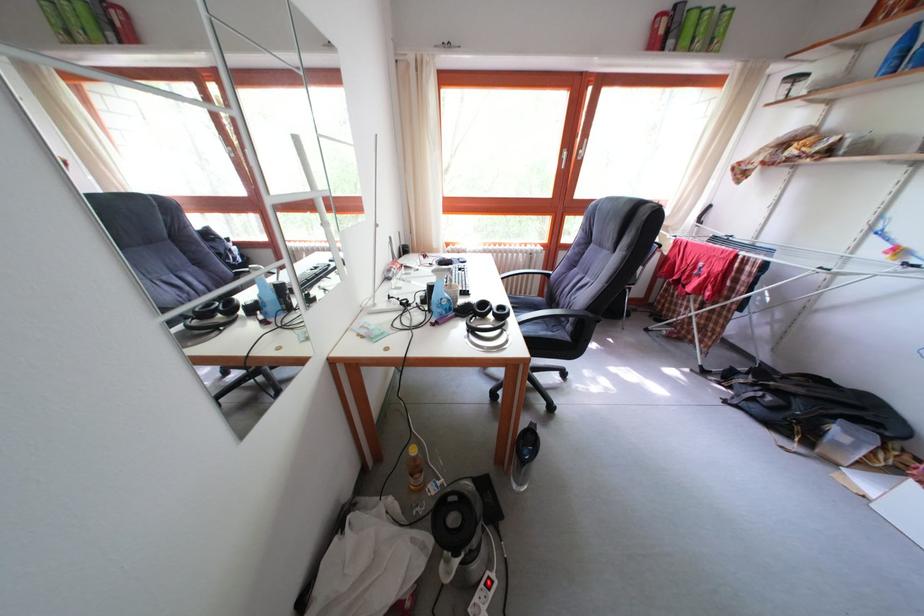
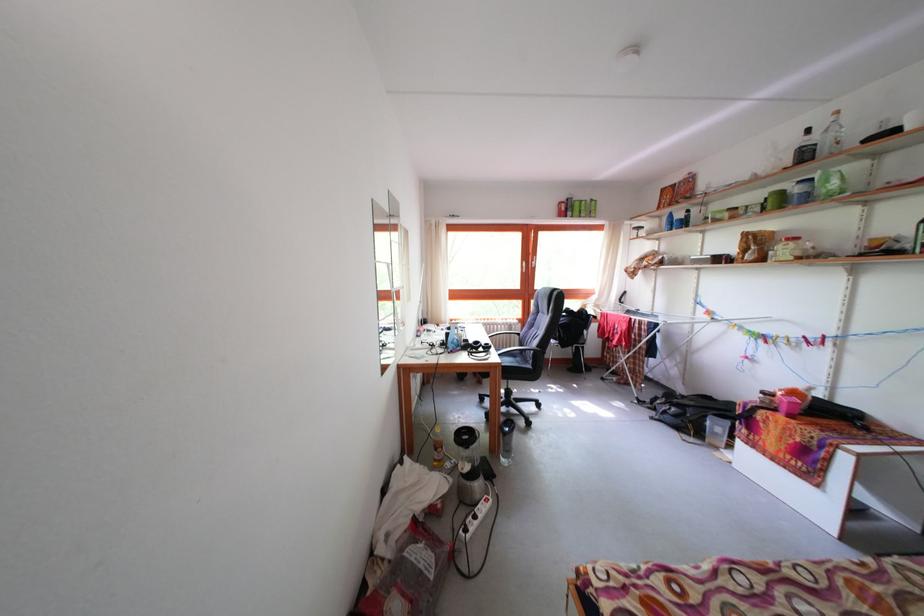
Find the pixel in the second image that matches point 499,315 in the first image.

(489, 352)